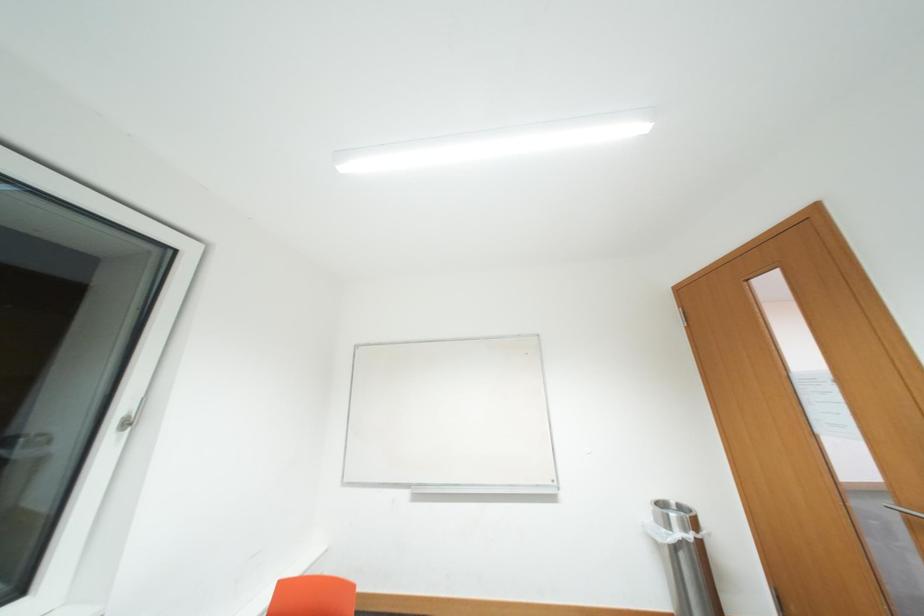
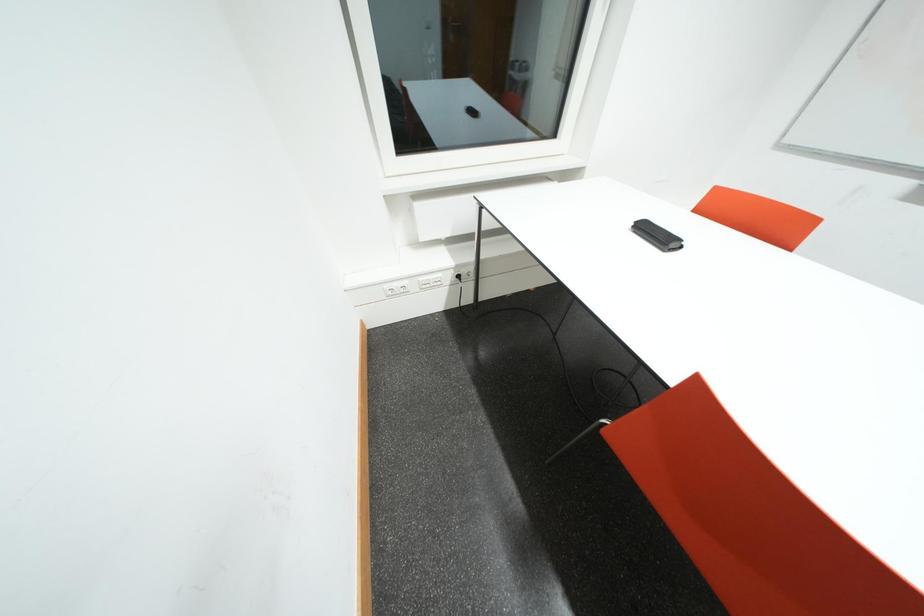
The first image is from the beginning of the video and the second image is from the end. How did the camera likely rotate when shooting the video?

The camera's rotation is toward left-down.